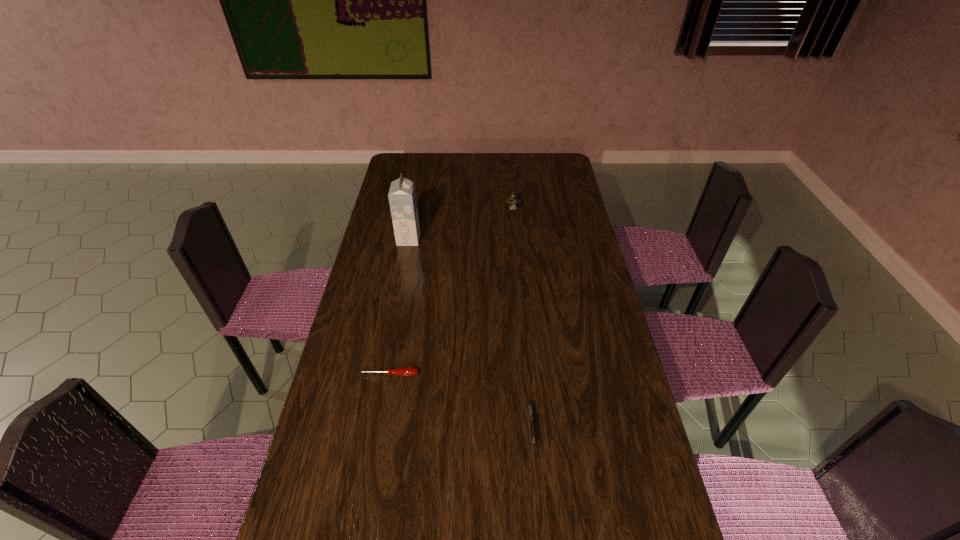
You are a GUI agent. You are given a task and a screenshot of the screen. Output one action in this format:
    pyautogui.click(x=<x>, y=<y>)
    Task: Click on the free space located 0.120m aimed along the barrel of the second shortest object
    
    Given the screenshot: What is the action you would take?
    pyautogui.click(x=539, y=515)

Where is `free spot located on the right of the second nearest object`? free spot located on the right of the second nearest object is located at coordinates (542, 374).

Where is `carton present at the left edge`? carton present at the left edge is located at coordinates (402, 196).

Where is `screwdriver that is at the left edge`? This screenshot has height=540, width=960. screwdriver that is at the left edge is located at coordinates (406, 371).

Identify the location of free space at the far edge. Image resolution: width=960 pixels, height=540 pixels. coord(459,172).

Locate an element on the screen. This screenshot has width=960, height=540. free space at the left edge is located at coordinates (394, 180).

Locate an element on the screen. free space at the right edge of the desktop is located at coordinates (581, 262).

This screenshot has height=540, width=960. In the image, there is a desktop. Identify the location of vacant space at the far right corner. (552, 158).

Locate an element on the screen. The width and height of the screenshot is (960, 540). empty space between the farthest object and the third tallest object is located at coordinates (522, 322).

Where is `vacant space in between the shortest object and the gun`? This screenshot has width=960, height=540. vacant space in between the shortest object and the gun is located at coordinates (460, 404).